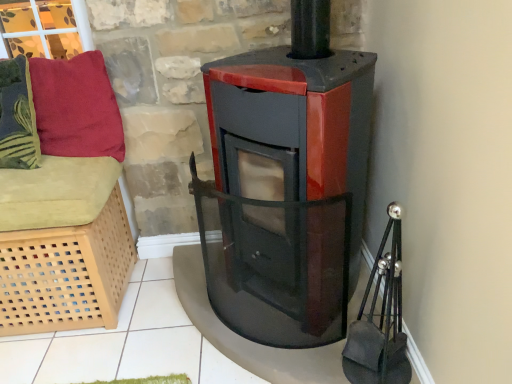
I want to click on empty space that is ontop of light wood lattice basket at left (from a real-world perspective), so click(x=41, y=170).